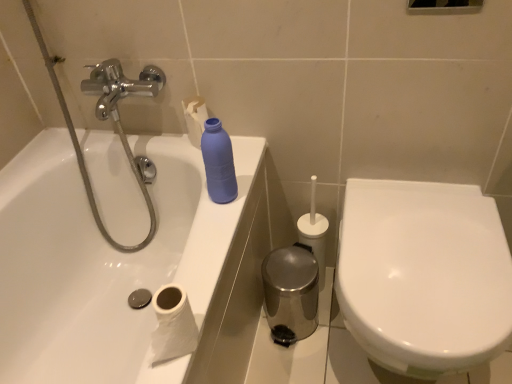
Question: Considering the relative sizes of matte blue plastic bottle at upper center and white paper at lower left in the image provided, is matte blue plastic bottle at upper center wider than white paper at lower left?

Choices:
 (A) yes
 (B) no

Answer: (B)

Question: Is white paper at lower left completely or partially inside matte blue plastic bottle at upper center?

Choices:
 (A) yes
 (B) no

Answer: (B)

Question: Is matte blue plastic bottle at upper center looking in the opposite direction of white paper at lower left?

Choices:
 (A) no
 (B) yes

Answer: (A)

Question: Can you confirm if matte blue plastic bottle at upper center is positioned to the left of white paper at lower left?

Choices:
 (A) no
 (B) yes

Answer: (A)

Question: Can you confirm if matte blue plastic bottle at upper center is taller than white paper at lower left?

Choices:
 (A) yes
 (B) no

Answer: (A)

Question: From the image's perspective, is white paper at lower left located above or below white glossy toilet at right?

Choices:
 (A) below
 (B) above

Answer: (B)

Question: Would you say white paper at lower left is to the left or to the right of white glossy toilet at right in the picture?

Choices:
 (A) right
 (B) left

Answer: (B)

Question: Is white paper at lower left in front of or behind white glossy toilet at right in the image?

Choices:
 (A) front
 (B) behind

Answer: (A)

Question: In terms of width, does white paper at lower left look wider or thinner when compared to white glossy toilet at right?

Choices:
 (A) thin
 (B) wide

Answer: (A)

Question: In terms of size, does matte blue plastic bottle at upper center appear bigger or smaller than white glossy toilet at right?

Choices:
 (A) small
 (B) big

Answer: (A)

Question: From a real-world perspective, is matte blue plastic bottle at upper center physically located above or below white glossy toilet at right?

Choices:
 (A) above
 (B) below

Answer: (A)

Question: Looking at their shapes, would you say matte blue plastic bottle at upper center is wider or thinner than white glossy toilet at right?

Choices:
 (A) wide
 (B) thin

Answer: (B)

Question: Is point (206, 119) positioned closer to the camera than point (509, 286)?

Choices:
 (A) closer
 (B) farther

Answer: (B)

Question: Is white paper at lower left inside or outside of matte blue plastic bottle at upper center?

Choices:
 (A) inside
 (B) outside

Answer: (B)

Question: From the image's perspective, relative to matte blue plastic bottle at upper center, is white paper at lower left above or below?

Choices:
 (A) above
 (B) below

Answer: (B)